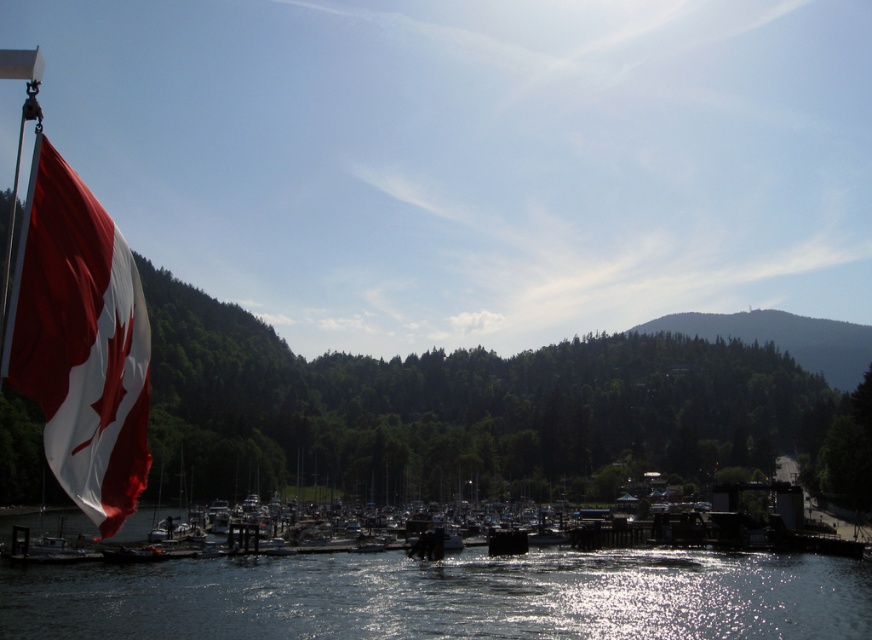
Is point (556, 550) positioned after point (117, 403)?

Yes, point (556, 550) is farther from viewer.

Locate an element on the screen. The width and height of the screenshot is (872, 640). transparent water at center is located at coordinates (446, 595).